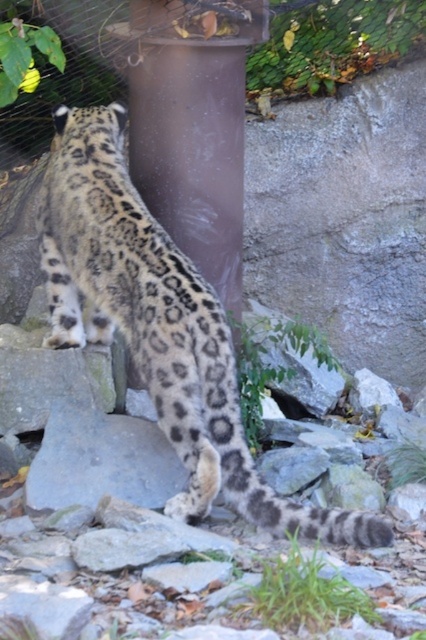
Is spotted fur snow leopard at center thinner than brushed metal fence at upper center?

No, spotted fur snow leopard at center is not thinner than brushed metal fence at upper center.

Does point (259, 497) come closer to viewer compared to point (40, 112)?

Yes, point (259, 497) is in front of point (40, 112).

Find the location of a particular element. The width and height of the screenshot is (426, 640). spotted fur snow leopard at center is located at coordinates (160, 326).

Does spotted fur snow leopard at center have a lesser height compared to brown textured pillar at center?

Incorrect, spotted fur snow leopard at center's height does not fall short of brown textured pillar at center's.

The width and height of the screenshot is (426, 640). What do you see at coordinates (160, 326) in the screenshot? I see `spotted fur snow leopard at center` at bounding box center [160, 326].

Find the location of a particular element. spotted fur snow leopard at center is located at coordinates (160, 326).

Can you confirm if brown textured pillar at center is smaller than brushed metal fence at upper center?

No, brown textured pillar at center is not smaller than brushed metal fence at upper center.

What do you see at coordinates (192, 131) in the screenshot? I see `brown textured pillar at center` at bounding box center [192, 131].

This screenshot has height=640, width=426. I want to click on brown textured pillar at center, so click(x=192, y=131).